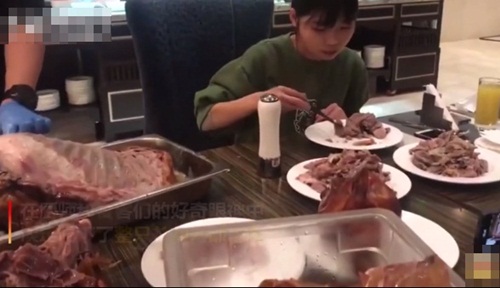
Where is `plastic container`? This screenshot has height=288, width=500. plastic container is located at coordinates (293, 233).